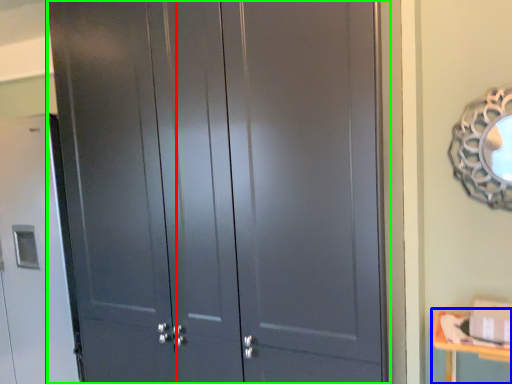
Question: Considering the real-world distances, which object is closest to screen door (highlighted by a red box)? changing table (highlighted by a blue box) or door (highlighted by a green box).

Choices:
 (A) changing table
 (B) door

Answer: (B)